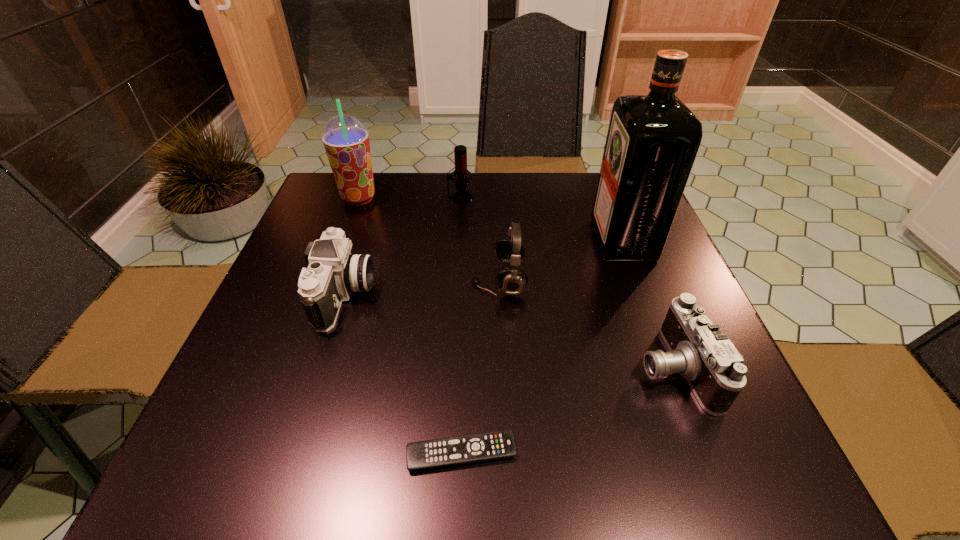
You are a GUI agent. You are given a task and a screenshot of the screen. Output one action in this format:
    pyautogui.click(x=<x>, y=<y>)
    Task: Click on the vacant space located 0.260m at the lens of the right camera
    The width and height of the screenshot is (960, 540).
    Given the screenshot: What is the action you would take?
    pyautogui.click(x=492, y=367)

What are the coordinates of `vacant space positioned 0.120m on the right of the nearest object` in the screenshot? It's located at (594, 453).

At what (x,y) coordinates should I click in order to perform the action: click on liquor situated at the far edge. Please return your answer as a coordinate pair (x, y). This screenshot has width=960, height=540. Looking at the image, I should click on (652, 141).

At what (x,y) coordinates should I click in order to perform the action: click on smoothie that is at the far edge. Please return your answer as a coordinate pair (x, y). Looking at the image, I should click on (346, 140).

Find the location of a particular element. The image size is (960, 540). microphone that is at the far edge is located at coordinates (460, 151).

Identify the location of object positioned at the near edge. The width and height of the screenshot is (960, 540). (450, 451).

Where is `smoothie at the left edge`? smoothie at the left edge is located at coordinates point(346,140).

You are a GUI agent. You are given a task and a screenshot of the screen. Output one action in this format:
    pyautogui.click(x=<x>, y=<y>)
    Task: Click on the camera that is positioned at the left edge
    This screenshot has width=960, height=540.
    Given the screenshot: What is the action you would take?
    pyautogui.click(x=333, y=273)

Find the location of a particular element. Image resolution: width=960 pixels, height=540 pixels. liquor that is at the right edge is located at coordinates (652, 141).

Identify the location of camera at the right edge. Image resolution: width=960 pixels, height=540 pixels. (698, 349).